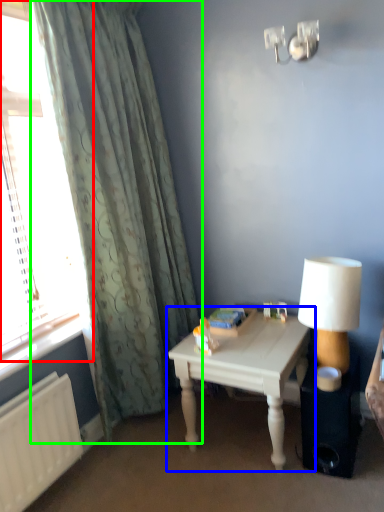
Question: Which object is the farthest from window (highlighted by a red box)? Choose among these: table (highlighted by a blue box) or curtain (highlighted by a green box).

Choices:
 (A) table
 (B) curtain

Answer: (A)